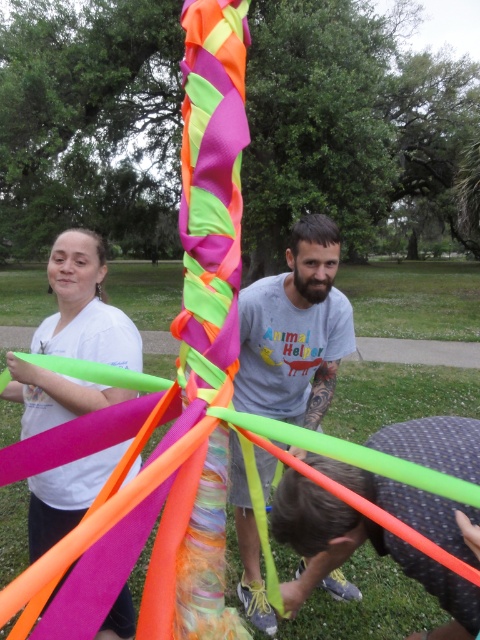
You are planning to hang a new decoration between the neon fabric ribbon at center and the neon green plastic hoop at lower center. Based on their heights, which object should you place the decoration above to ensure it is visible?

Since the neon fabric ribbon at center is taller than the neon green plastic hoop at lower center, you should place the decoration above the neon fabric ribbon at center to ensure visibility.